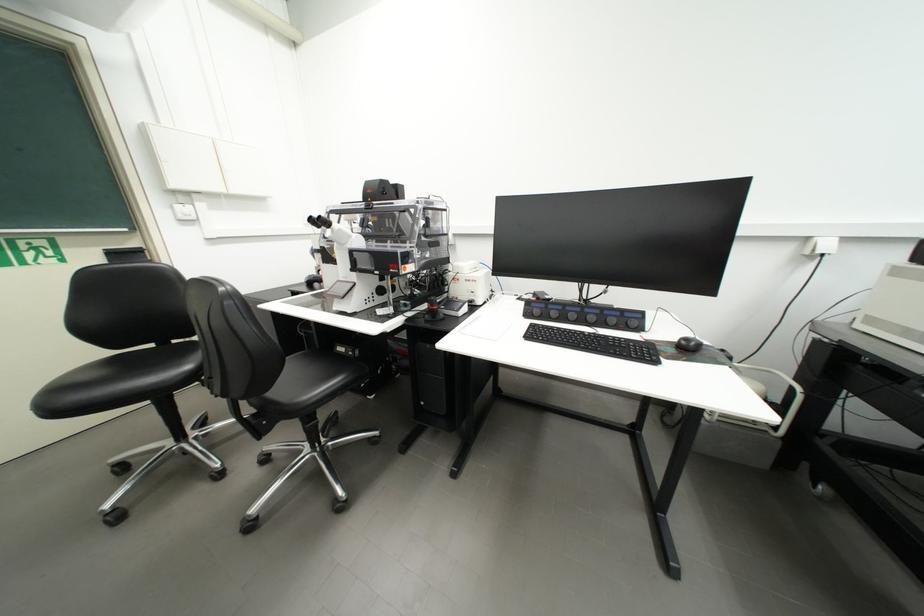
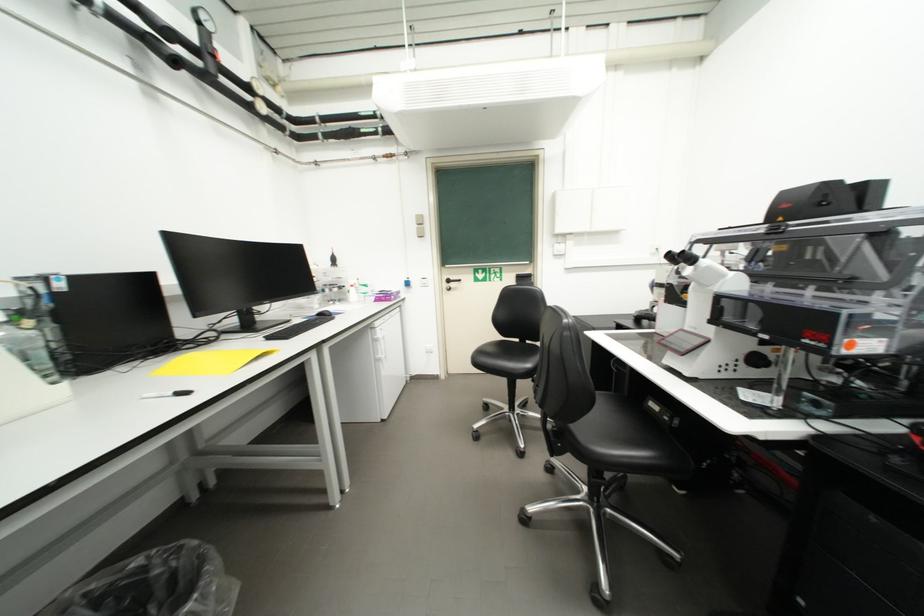
Question: Based on the continuous images, in which direction is the camera rotating? Reply with the corresponding letter.

Choices:
 (A) Left
 (B) Right
 (C) Up
 (D) Down

Answer: (A)